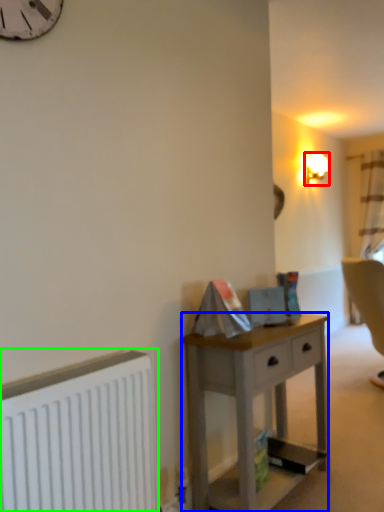
Question: Considering the real-world distances, which object is farthest from lamp (highlighted by a red box)? desk (highlighted by a blue box) or radiator (highlighted by a green box)?

Choices:
 (A) desk
 (B) radiator

Answer: (B)